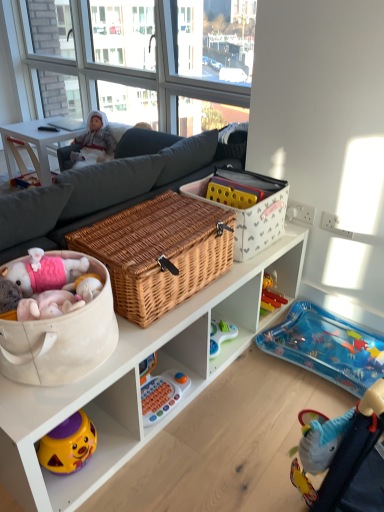
Question: From their relative heights in the image, would you say orange plastic toy at center is taller or shorter than white wicker basket at upper center, acting as the 1th storage box starting from the right?

Choices:
 (A) short
 (B) tall

Answer: (A)

Question: Is orange plastic toy at center inside the boundaries of white wicker basket at upper center, which is counted as the second storage box, starting from the front, or outside?

Choices:
 (A) inside
 (B) outside

Answer: (B)

Question: Which is farther from the orange plastic toy at center?

Choices:
 (A) blue fabric baby carriage at lower right
 (B) white wicker basket at upper center, which is counted as the second storage box, starting from the front
 (C) transparent glass window at upper center
 (D) beige fabric basket at lower left, which is the first storage box in left-to-right order
 (E) white wooden table at upper left

Answer: (C)

Question: Which object is the farthest from the beige fabric basket at lower left, which is the first storage box in left-to-right order?

Choices:
 (A) transparent plastic infant bed at lower right
 (B) transparent glass window at upper center
 (C) blue fabric baby carriage at lower right
 (D) white plush doll at upper left
 (E) orange plastic toy at center

Answer: (B)